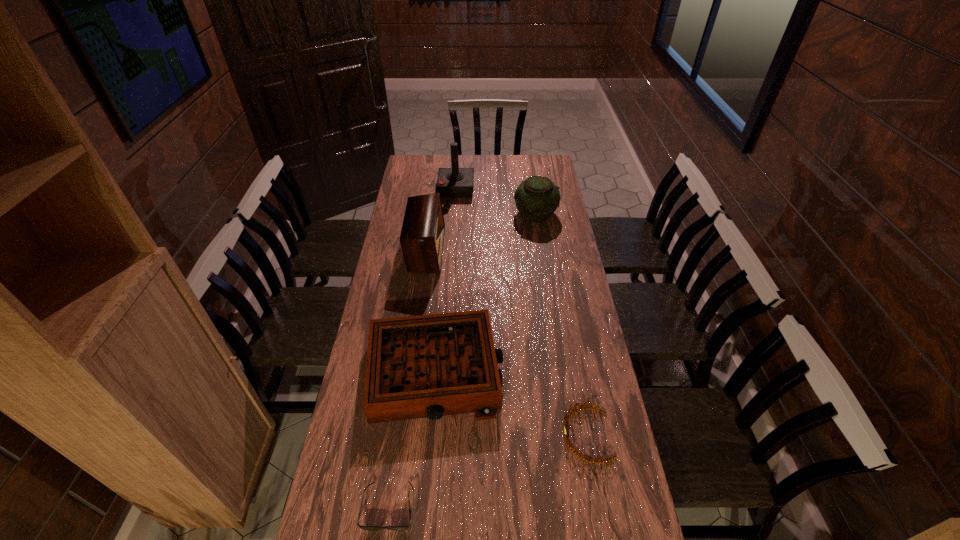
Locate an element on the screen. vacant region located on the left of the pottery is located at coordinates [439, 213].

The width and height of the screenshot is (960, 540). I want to click on vacant region located 0.120m on the front of the gameboard, so click(x=426, y=467).

You are a GUI agent. You are given a task and a screenshot of the screen. Output one action in this format:
    pyautogui.click(x=<x>, y=<y>)
    Task: Click on the vacant space located 0.060m on the front-facing side of the second shortest object
    
    Given the screenshot: What is the action you would take?
    pyautogui.click(x=540, y=435)

Identify the location of free space located on the front-facing side of the second shortest object. The image size is (960, 540). (466, 435).

Find the location of `free space located on the front-facing side of the second shortest object`. free space located on the front-facing side of the second shortest object is located at coordinates (487, 435).

At what (x,y) coordinates should I click in order to perform the action: click on radio receiver positioned at the left edge. Please return your answer as a coordinate pair (x, y). This screenshot has width=960, height=540. Looking at the image, I should click on (422, 235).

This screenshot has width=960, height=540. In order to click on gameboard that is at the left edge in this screenshot , I will do `click(428, 366)`.

Where is `sunglasses that is at the left edge`? The width and height of the screenshot is (960, 540). sunglasses that is at the left edge is located at coordinates (406, 527).

Locate an element on the screen. The height and width of the screenshot is (540, 960). pottery located at the right edge is located at coordinates (537, 197).

Where is `tiara that is positioned at the right edge`? This screenshot has width=960, height=540. tiara that is positioned at the right edge is located at coordinates (568, 415).